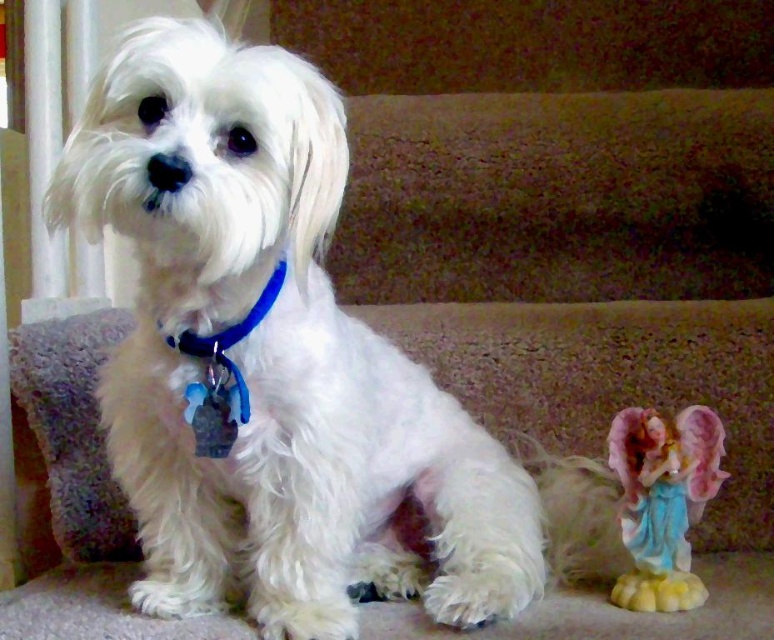
Question: Among these points, which one is nearest to the camera?

Choices:
 (A) (622, 540)
 (B) (502, 598)
 (C) (204, 435)

Answer: (C)

Question: Which is nearer to the white fluffy dog at center?

Choices:
 (A) porcelain angel at lower right
 (B) blue plastic collar at center

Answer: (B)

Question: Observing the image, what is the correct spatial positioning of porcelain angel at lower right in reference to blue plastic collar at center?

Choices:
 (A) right
 (B) left

Answer: (A)

Question: Which is farther from the porcelain angel at lower right?

Choices:
 (A) blue plastic collar at center
 (B) white fluffy dog at center

Answer: (A)

Question: Is white fluffy dog at center thinner than porcelain angel at lower right?

Choices:
 (A) no
 (B) yes

Answer: (A)

Question: Is porcelain angel at lower right to the left of blue plastic collar at center from the viewer's perspective?

Choices:
 (A) no
 (B) yes

Answer: (A)